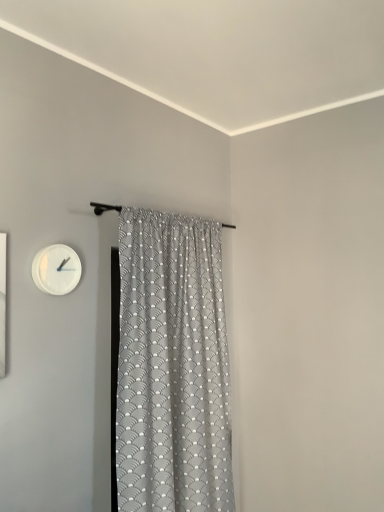
The image size is (384, 512). Describe the element at coordinates (56, 269) in the screenshot. I see `white matte wall clock at upper left` at that location.

At what (x,y) coordinates should I click in order to perform the action: click on white matte wall clock at upper left. Please return your answer as a coordinate pair (x, y). Image resolution: width=384 pixels, height=512 pixels. Looking at the image, I should click on (56, 269).

In order to face white matte wall clock at upper left, should I rotate leftwards or rightwards?

You should rotate left by 17.412 degrees.

What is the approximate height of white matte wall clock at upper left?

white matte wall clock at upper left is 8.58 inches tall.

I want to click on gray textured fabric curtain at center, so click(x=169, y=367).

Describe the element at coordinates (169, 367) in the screenshot. I see `gray textured fabric curtain at center` at that location.

I want to click on white matte wall clock at upper left, so click(56, 269).

Which object is positioned more to the right, white matte wall clock at upper left or gray textured fabric curtain at center?

From the viewer's perspective, gray textured fabric curtain at center appears more on the right side.

Is white matte wall clock at upper left in front of or behind gray textured fabric curtain at center in the image?

white matte wall clock at upper left is positioned farther from the viewer than gray textured fabric curtain at center.

Considering the points (61, 291) and (164, 237), which point is behind, point (61, 291) or point (164, 237)?

Positioned behind is point (164, 237).

From the image's perspective, is white matte wall clock at upper left on gray textured fabric curtain at center?

Yes, from the image's perspective, white matte wall clock at upper left is on top of gray textured fabric curtain at center.

From a real-world perspective, is white matte wall clock at upper left above or below gray textured fabric curtain at center?

From a real-world perspective, white matte wall clock at upper left is physically above gray textured fabric curtain at center.

Which of these two, white matte wall clock at upper left or gray textured fabric curtain at center, is wider?

gray textured fabric curtain at center.

Between white matte wall clock at upper left and gray textured fabric curtain at center, which one has less height?

white matte wall clock at upper left.

Can you confirm if white matte wall clock at upper left is smaller than gray textured fabric curtain at center?

Correct, white matte wall clock at upper left occupies less space than gray textured fabric curtain at center.

Do you think white matte wall clock at upper left is within gray textured fabric curtain at center, or outside of it?

The correct answer is: outside.

Is white matte wall clock at upper left touching gray textured fabric curtain at center?

No, white matte wall clock at upper left is not in contact with gray textured fabric curtain at center.

From the picture: Could you tell me if white matte wall clock at upper left is facing gray textured fabric curtain at center?

No, white matte wall clock at upper left is not oriented towards gray textured fabric curtain at center.

What's the angular difference between white matte wall clock at upper left and gray textured fabric curtain at center's facing directions?

white matte wall clock at upper left and gray textured fabric curtain at center are facing 0.631 degrees away from each other.

Image resolution: width=384 pixels, height=512 pixels. Find the location of `wall clock behind the gray textured fabric curtain at center`. wall clock behind the gray textured fabric curtain at center is located at coordinates (56, 269).

Considering the relative positions of gray textured fabric curtain at center and white matte wall clock at upper left in the image provided, is gray textured fabric curtain at center to the left of white matte wall clock at upper left from the viewer's perspective?

No, gray textured fabric curtain at center is not to the left of white matte wall clock at upper left.

Is gray textured fabric curtain at center further to camera compared to white matte wall clock at upper left?

No, the depth of gray textured fabric curtain at center is less than that of white matte wall clock at upper left.

Is point (142, 279) behind point (41, 283)?

Yes.

From the image's perspective, is gray textured fabric curtain at center located above or below white matte wall clock at upper left?

gray textured fabric curtain at center is situated lower than white matte wall clock at upper left in the image.

From a real-world perspective, between gray textured fabric curtain at center and white matte wall clock at upper left, who is vertically lower?

gray textured fabric curtain at center is physically lower.

Considering the sizes of objects gray textured fabric curtain at center and white matte wall clock at upper left in the image provided, who is wider, gray textured fabric curtain at center or white matte wall clock at upper left?

gray textured fabric curtain at center.

Considering the relative sizes of gray textured fabric curtain at center and white matte wall clock at upper left in the image provided, is gray textured fabric curtain at center shorter than white matte wall clock at upper left?

In fact, gray textured fabric curtain at center may be taller than white matte wall clock at upper left.

Does gray textured fabric curtain at center have a smaller size compared to white matte wall clock at upper left?

Actually, gray textured fabric curtain at center might be larger than white matte wall clock at upper left.

Which is correct: gray textured fabric curtain at center is inside white matte wall clock at upper left, or outside of it?

A: gray textured fabric curtain at center is outside white matte wall clock at upper left.

Is the surface of gray textured fabric curtain at center in direct contact with white matte wall clock at upper left?

gray textured fabric curtain at center is not next to white matte wall clock at upper left, and they're not touching.

Is gray textured fabric curtain at center oriented away from white matte wall clock at upper left?

gray textured fabric curtain at center is not turned away from white matte wall clock at upper left.

Locate an element on the screen. curtain that is below the white matte wall clock at upper left (from the image's perspective) is located at coordinates (169, 367).

Where is `wall clock behind the gray textured fabric curtain at center`? wall clock behind the gray textured fabric curtain at center is located at coordinates (56, 269).

The height and width of the screenshot is (512, 384). I want to click on wall clock on the left of gray textured fabric curtain at center, so click(x=56, y=269).